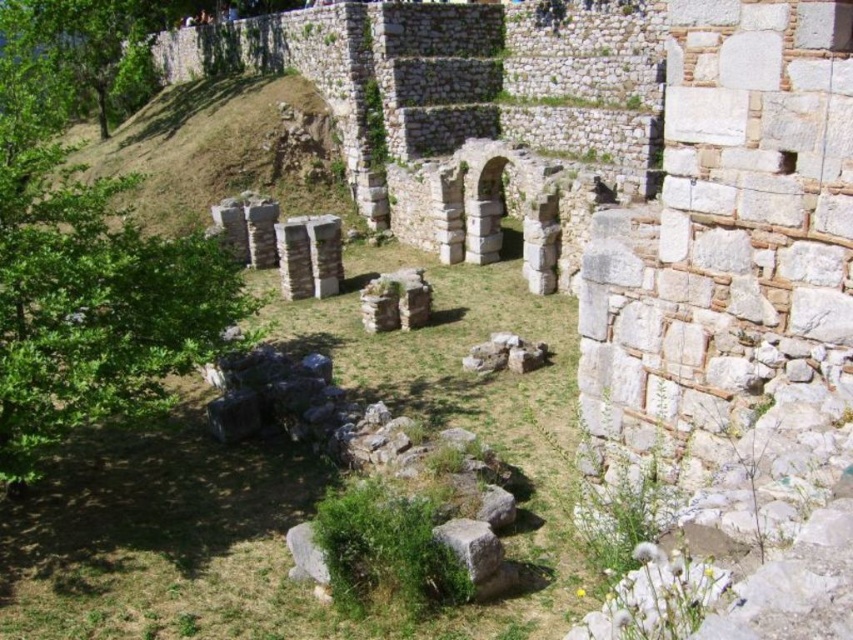
Looking at this image, who is taller, green grass at center or green leafy tree at left?

green leafy tree at left is taller.

Is green grass at center thinner than green leafy tree at left?

Correct, green grass at center's width is less than green leafy tree at left's.

Describe the element at coordinates (299, 483) in the screenshot. I see `green grass at center` at that location.

The width and height of the screenshot is (853, 640). I want to click on green grass at center, so click(299, 483).

Between point (415, 400) and point (471, 552), which one is positioned behind?

The point (415, 400) is behind.

Does point (293, 632) lie behind point (473, 525)?

No, it is in front of (473, 525).

Describe the element at coordinates (299, 483) in the screenshot. The width and height of the screenshot is (853, 640). I see `green grass at center` at that location.

Where is `green grass at center`? green grass at center is located at coordinates pyautogui.click(x=299, y=483).

Is green leafy tree at left in front of green mossy rock at center?

That is False.

Can you confirm if green leafy tree at left is thinner than green mossy rock at center?

No.

At what (x,y) coordinates should I click in order to perform the action: click on green leafy tree at left. Please return your answer as a coordinate pair (x, y). This screenshot has width=853, height=640. Looking at the image, I should click on (84, 273).

Identify the location of green leafy tree at left. (84, 273).